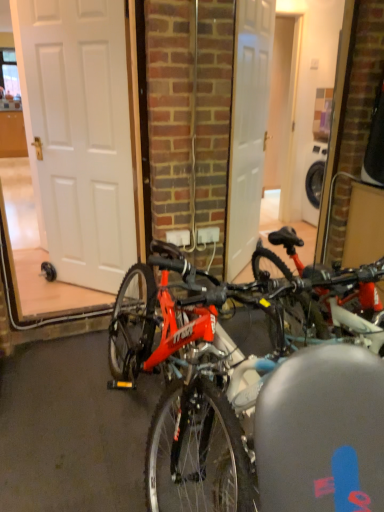
Question: Does point (327, 414) appear closer or farther from the camera than point (97, 45)?

Choices:
 (A) closer
 (B) farther

Answer: (A)

Question: From the image's perspective, is shiny red bicycle at center positioned above or below white matte door at left?

Choices:
 (A) above
 (B) below

Answer: (B)

Question: Would you say shiny red bicycle at center is to the left or to the right of white matte door at left in the picture?

Choices:
 (A) left
 (B) right

Answer: (B)

Question: Considering their positions, is white matte door at left located in front of or behind shiny red bicycle at center?

Choices:
 (A) behind
 (B) front

Answer: (A)

Question: In terms of size, does white matte door at left appear bigger or smaller than shiny red bicycle at center?

Choices:
 (A) big
 (B) small

Answer: (B)

Question: From the image's perspective, is white matte door at left above or below shiny red bicycle at center?

Choices:
 (A) below
 (B) above

Answer: (B)

Question: Looking at their shapes, would you say white matte door at left is wider or thinner than shiny red bicycle at center?

Choices:
 (A) wide
 (B) thin

Answer: (B)